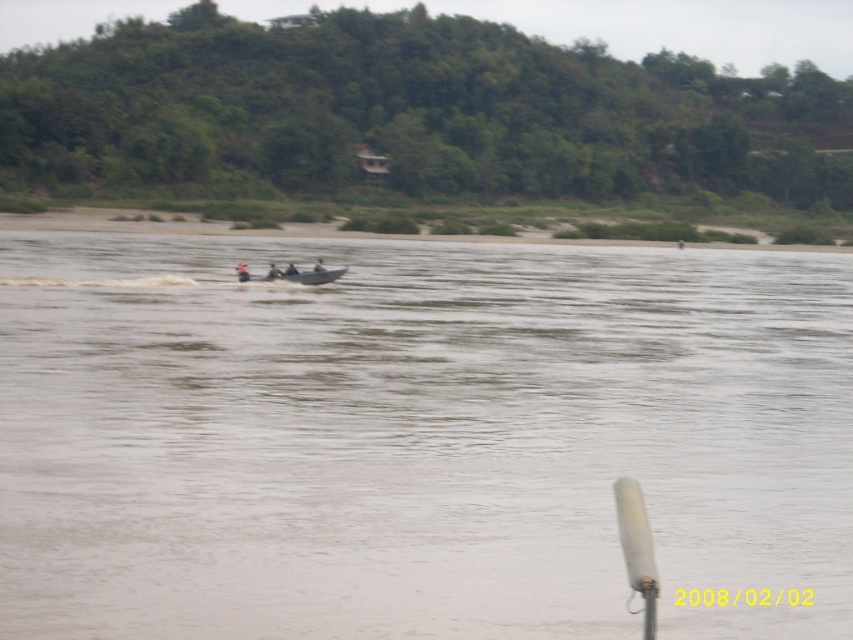
Which is more to the left, orange life vest at center or dark blue fabric person at center?

From the viewer's perspective, orange life vest at center appears more on the left side.

Can you confirm if orange life vest at center is thinner than dark blue fabric person at center?

In fact, orange life vest at center might be wider than dark blue fabric person at center.

Which is in front, point (239, 268) or point (294, 275)?

Positioned in front is point (294, 275).

Find the location of a particular element. The image size is (853, 640). orange life vest at center is located at coordinates (242, 272).

Is gray plastic boat at center shorter than smooth gray boat at center?

In fact, gray plastic boat at center may be taller than smooth gray boat at center.

Can you confirm if gray plastic boat at center is bigger than smooth gray boat at center?

Yes, gray plastic boat at center is bigger than smooth gray boat at center.

Find the location of a particular element. This screenshot has width=853, height=640. gray plastic boat at center is located at coordinates (306, 275).

Does brown muddy water at center lie behind smooth gray boat at center?

No, it is in front of smooth gray boat at center.

Who is positioned more to the left, brown muddy water at center or smooth gray boat at center?

smooth gray boat at center

Consider the image. Who is more forward, (556,499) or (273,264)?

Positioned in front is point (556,499).

Identify the location of brown muddy water at center. Image resolution: width=853 pixels, height=640 pixels. (416, 436).